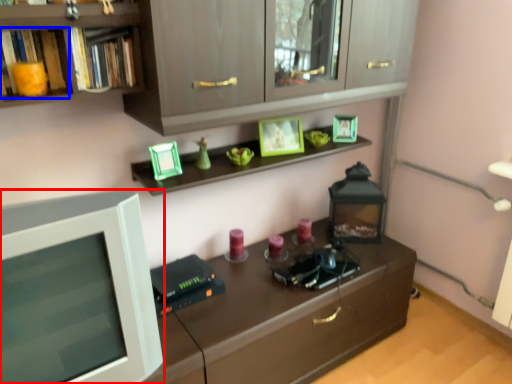
Question: Which point is closer to the camera, computer monitor (highlighted by a red box) or book (highlighted by a blue box)?

Choices:
 (A) computer monitor
 (B) book

Answer: (A)